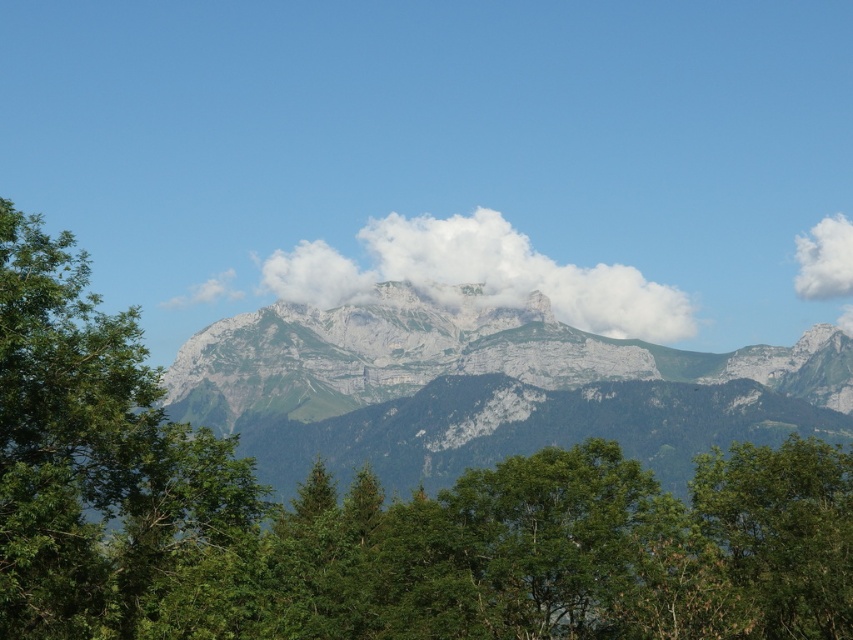
Based on the photo, you are a bird soaring in the sky. You see the green leafy tree at center and the white fluffy cloud at center. Which one has a wider spread from your perspective?

The green leafy tree at center has a wider spread than the white fluffy cloud at center according to the description.

You are an observer standing at the base of the mountain. You see the green leafy tree at center and the white fluffy cloud at center. Which object is located to the right side?

The white fluffy cloud at center is located to the right side of the green leafy tree at center.